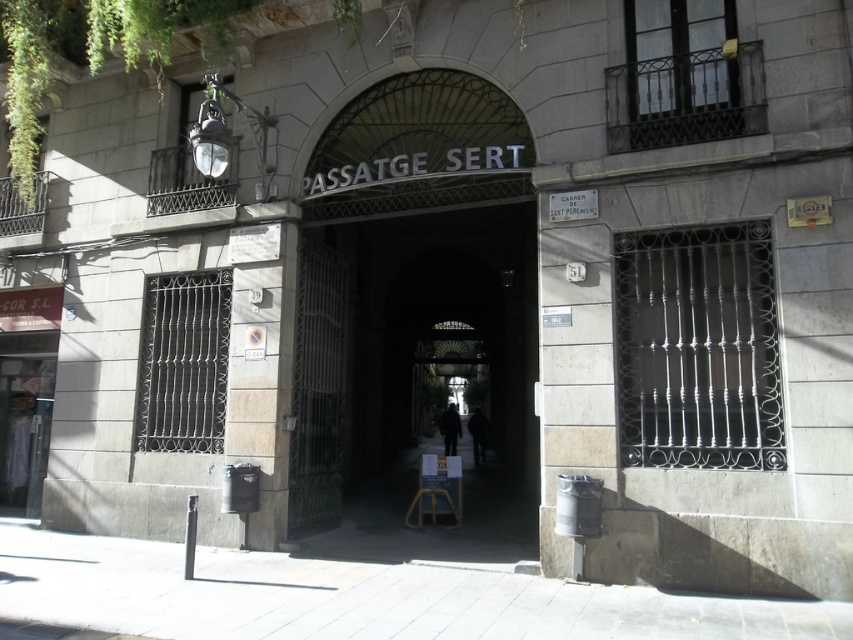
You are standing at the entrance of Passatge Sert and want to take a photo of the arched gateway. If you move forward by 10 feet, will the point at coordinates point (321, 349) become closer to the camera?

The point at coordinates point (321, 349) is currently 28.94 feet away from the camera. Moving forward by 10 feet would reduce the distance to 18.94 feet, so yes, it will become closer to the camera.

You are standing at the entrance of Passatge Sert and notice two points marked on the ground. One is at coordinate point (534, 273) and the other at point (416, 497). If you were to walk towards the building, which point would you encounter first?

Point (416, 497) would be encountered first because it is in front of point (534, 273), which is positioned behind it relative to the entrance.

Looking at this image, you are a delivery person trying to enter the entrance of Passatge Sert. You see a dark metal gate at center and a wooden stool at center. Which object is larger in size?

The dark metal gate at center is bigger than the wooden stool at center, so the dark metal gate at center is larger in size.